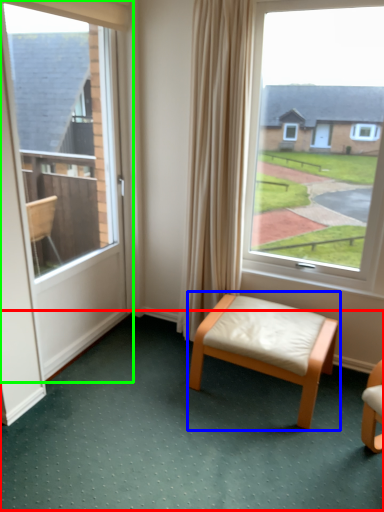
Question: Which object is positioned closest to golf course (highlighted by a red box)? Select from stool (highlighted by a blue box) and door (highlighted by a green box).

Choices:
 (A) stool
 (B) door

Answer: (A)